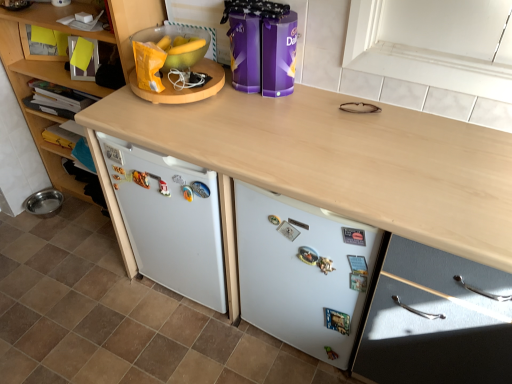
Question: Is wooden cabinet at left, the second cabinetry viewed from the right, to the right of white matte refrigerator at lower center from the viewer's perspective?

Choices:
 (A) no
 (B) yes

Answer: (A)

Question: Would you say wooden cabinet at left, the second cabinetry viewed from the right, contains white matte refrigerator at lower center?

Choices:
 (A) yes
 (B) no

Answer: (B)

Question: Considering the relative sizes of wooden cabinet at left, the 1th cabinetry in the left-to-right sequence, and white matte refrigerator at lower center in the image provided, is wooden cabinet at left, the 1th cabinetry in the left-to-right sequence, taller than white matte refrigerator at lower center?

Choices:
 (A) no
 (B) yes

Answer: (B)

Question: Can you confirm if wooden cabinet at left, the 1th cabinetry in the left-to-right sequence, is smaller than white matte refrigerator at lower center?

Choices:
 (A) yes
 (B) no

Answer: (B)

Question: Is wooden cabinet at left, the second cabinetry viewed from the right, outside of white matte refrigerator at lower center?

Choices:
 (A) yes
 (B) no

Answer: (A)

Question: Is wooden cabinet at left, the second cabinetry viewed from the right, placed right next to white matte refrigerator at lower center?

Choices:
 (A) yes
 (B) no

Answer: (B)

Question: From a real-world perspective, does purple glossy chocolate tins at center, arranged as the 2th appliance when viewed from the left, sit lower than white matte refrigerator at lower center?

Choices:
 (A) no
 (B) yes

Answer: (A)

Question: Would you say purple glossy chocolate tins at center, positioned as the 1th appliance in right-to-left order, contains white matte refrigerator at lower center?

Choices:
 (A) no
 (B) yes

Answer: (A)

Question: Is purple glossy chocolate tins at center, arranged as the 2th appliance when viewed from the left, positioned with its back to white matte refrigerator at lower center?

Choices:
 (A) no
 (B) yes

Answer: (A)

Question: Can we say purple glossy chocolate tins at center, arranged as the 2th appliance when viewed from the left, lies outside white matte refrigerator at lower center?

Choices:
 (A) no
 (B) yes

Answer: (B)

Question: Does purple glossy chocolate tins at center, arranged as the 2th appliance when viewed from the left, have a smaller size compared to white matte refrigerator at lower center?

Choices:
 (A) no
 (B) yes

Answer: (B)

Question: Is purple glossy chocolate tins at center, positioned as the 1th appliance in right-to-left order, closer to camera compared to white matte refrigerator at lower center?

Choices:
 (A) yes
 (B) no

Answer: (B)

Question: Is purple glossy chocolate tins at center, arranged as the 2th appliance when viewed from the left, located within white matte refrigerator at lower center?

Choices:
 (A) yes
 (B) no

Answer: (B)